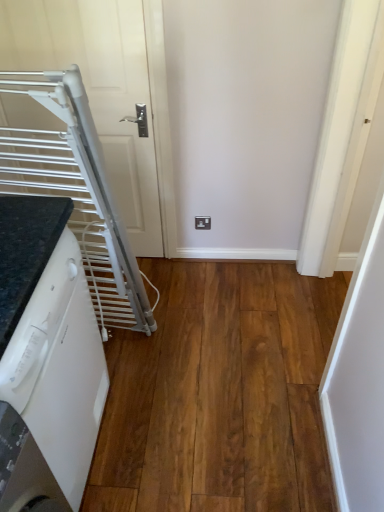
Question: Does brown wood flooring at lower left lie in front of white matte door at upper left?

Choices:
 (A) yes
 (B) no

Answer: (A)

Question: Is brown wood flooring at lower left shorter than white matte door at upper left?

Choices:
 (A) no
 (B) yes

Answer: (B)

Question: Is brown wood flooring at lower left positioned behind white matte door at upper left?

Choices:
 (A) yes
 (B) no

Answer: (B)

Question: Considering the relative positions of brown wood flooring at lower left and white matte door at upper left in the image provided, is brown wood flooring at lower left to the left of white matte door at upper left from the viewer's perspective?

Choices:
 (A) yes
 (B) no

Answer: (B)

Question: Can you confirm if brown wood flooring at lower left is smaller than white matte door at upper left?

Choices:
 (A) yes
 (B) no

Answer: (A)

Question: From a real-world perspective, relative to white matte door at upper left, is brown wood flooring at lower left vertically above or below?

Choices:
 (A) below
 (B) above

Answer: (A)

Question: From the image's perspective, is brown wood flooring at lower left located above or below white matte door at upper left?

Choices:
 (A) above
 (B) below

Answer: (B)

Question: Is brown wood flooring at lower left spatially inside white matte door at upper left, or outside of it?

Choices:
 (A) inside
 (B) outside

Answer: (B)

Question: Looking at the image, does brown wood flooring at lower left seem bigger or smaller compared to white matte door at upper left?

Choices:
 (A) big
 (B) small

Answer: (B)

Question: Is white matte door at upper left in front of or behind white glossy dishwasher at lower left in the image?

Choices:
 (A) front
 (B) behind

Answer: (B)

Question: From the image's perspective, is white matte door at upper left located above or below white glossy dishwasher at lower left?

Choices:
 (A) above
 (B) below

Answer: (A)

Question: In terms of size, does white matte door at upper left appear bigger or smaller than white glossy dishwasher at lower left?

Choices:
 (A) big
 (B) small

Answer: (B)

Question: Looking at their shapes, would you say white matte door at upper left is wider or thinner than white glossy dishwasher at lower left?

Choices:
 (A) thin
 (B) wide

Answer: (A)

Question: Is white glossy dishwasher at lower left wider or thinner than brown wood flooring at lower left?

Choices:
 (A) thin
 (B) wide

Answer: (A)

Question: Is point (29, 353) closer or farther from the camera than point (195, 426)?

Choices:
 (A) farther
 (B) closer

Answer: (B)